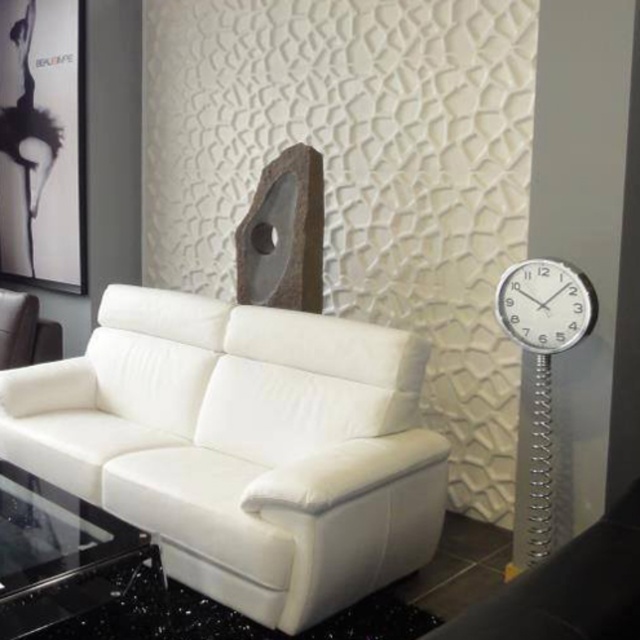
You are standing in the living room and want to hang a new matte black picture frame at upper left. The current coordinates are point (42,141). Is this point suitable for hanging the frame?

Yes, point (42,141) is suitable for hanging the matte black picture frame at upper left as it corresponds to that exact location.

You are a delivery person trying to place a 1.5 meter long sofa in the living room. The current white leather couch at center and white leather armchair at left are in the way. Can you fit the new sofa between them without moving any existing furniture?

The distance between the white leather couch at center and the white leather armchair at left is 1.37 meters. Since the new sofa is 1.5 meters long, it cannot fit in the space between them without moving existing furniture.

You are sitting on the white leather armchair at left and want to reach the remote control placed on the white leather couch at center. Which direction should you move to get to the couch?

The white leather couch at center is to the right of the white leather armchair at left, so you should move to your right to reach the couch.